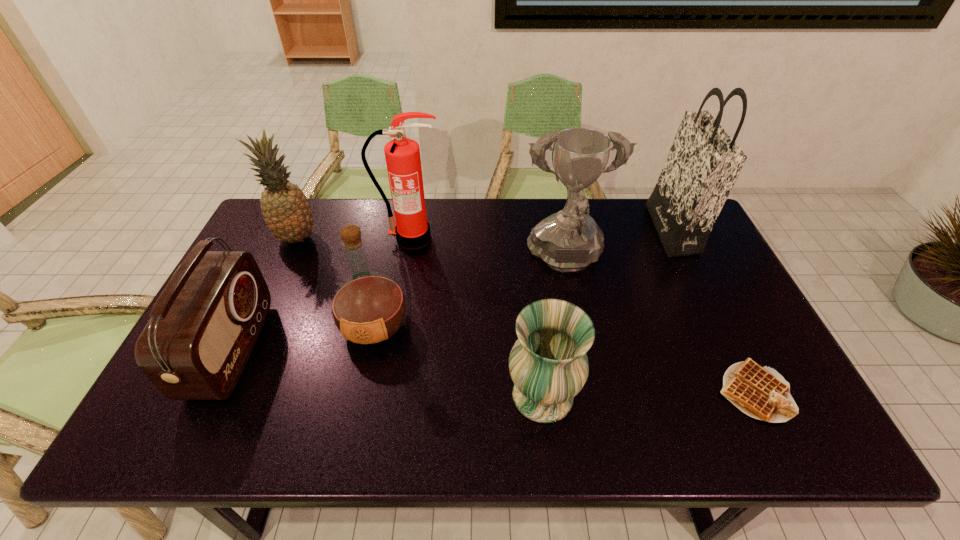
At what (x,y) coordinates should I click in order to perform the action: click on vacant region located 0.360m on the front of the shopping bag with the design. Please return your answer as a coordinate pair (x, y). The height and width of the screenshot is (540, 960). Looking at the image, I should click on coord(546,230).

Where is `free space located 0.290m with the nozzle aimed from the fire extinguisher`? free space located 0.290m with the nozzle aimed from the fire extinguisher is located at coordinates (397, 320).

Identify the location of vacant space located 0.110m on the side with emblem of the award. This screenshot has width=960, height=540. (578, 323).

The width and height of the screenshot is (960, 540). Identify the location of blank space located 0.340m on the right of the pineapple. (423, 238).

At what (x,y) coordinates should I click in order to perform the action: click on free location located 0.070m on the front label of the liquor. Please return your answer as a coordinate pair (x, y). Image resolution: width=960 pixels, height=540 pixels. Looking at the image, I should click on (363, 380).

Identify the location of free region located 0.240m on the front panel of the radio receiver. This screenshot has width=960, height=540. (348, 350).

At what (x,y) coordinates should I click in order to perform the action: click on vacant point located 0.380m on the back of the vase. Please return your answer as a coordinate pair (x, y). The height and width of the screenshot is (540, 960). Looking at the image, I should click on (527, 260).

Identify the location of vacant space located 0.300m on the left of the waffle. (590, 392).

This screenshot has height=540, width=960. What are the coordinates of `shopping bag present at the far edge` in the screenshot? It's located at (704, 162).

Find the location of `fire extinguisher that is at the far edge`. fire extinguisher that is at the far edge is located at coordinates tap(412, 230).